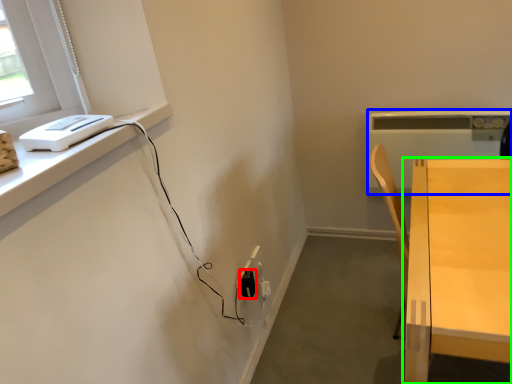
Question: Which object is the closest to the electric outlet (highlighted by a red box)? Choose among these: appliance (highlighted by a blue box) or table (highlighted by a green box).

Choices:
 (A) appliance
 (B) table

Answer: (B)